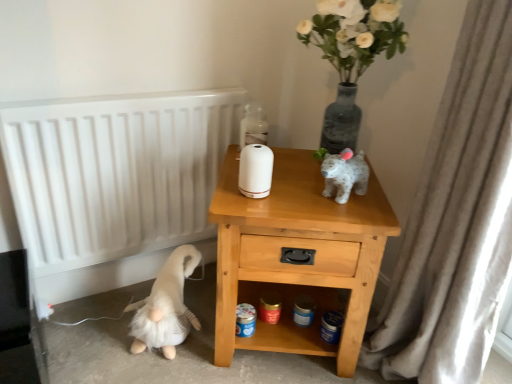
The image size is (512, 384). Identify the location of free point to the left of white plush gnome at lower left. (91, 334).